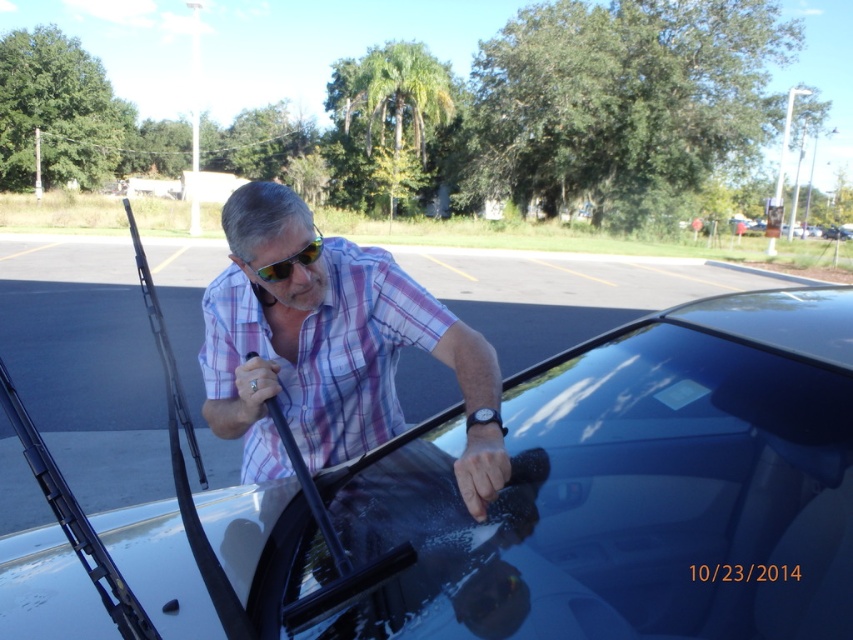
Does plaid shirt at center lie behind yellow reflective lenses at center?

No, plaid shirt at center is in front of yellow reflective lenses at center.

Who is taller, plaid shirt at center or yellow reflective lenses at center?

plaid shirt at center

Is point (279, 248) closer to camera compared to point (318, 234)?

Yes, it is in front of point (318, 234).

Locate an element on the screen. The width and height of the screenshot is (853, 640). plaid shirt at center is located at coordinates (332, 349).

Between glossy white car at center and plaid shirt at center, which one appears on the right side from the viewer's perspective?

glossy white car at center

Is glossy white car at center to the right of plaid shirt at center from the viewer's perspective?

Indeed, glossy white car at center is positioned on the right side of plaid shirt at center.

I want to click on glossy white car at center, so click(631, 488).

Does glossy white car at center come in front of yellow reflective lenses at center?

Yes, glossy white car at center is in front of yellow reflective lenses at center.

Is glossy white car at center below yellow reflective lenses at center?

Yes.

Who is more distant from viewer, [784,548] or [262,264]?

The point [262,264] is behind.

Locate an element on the screen. The height and width of the screenshot is (640, 853). glossy white car at center is located at coordinates (631, 488).